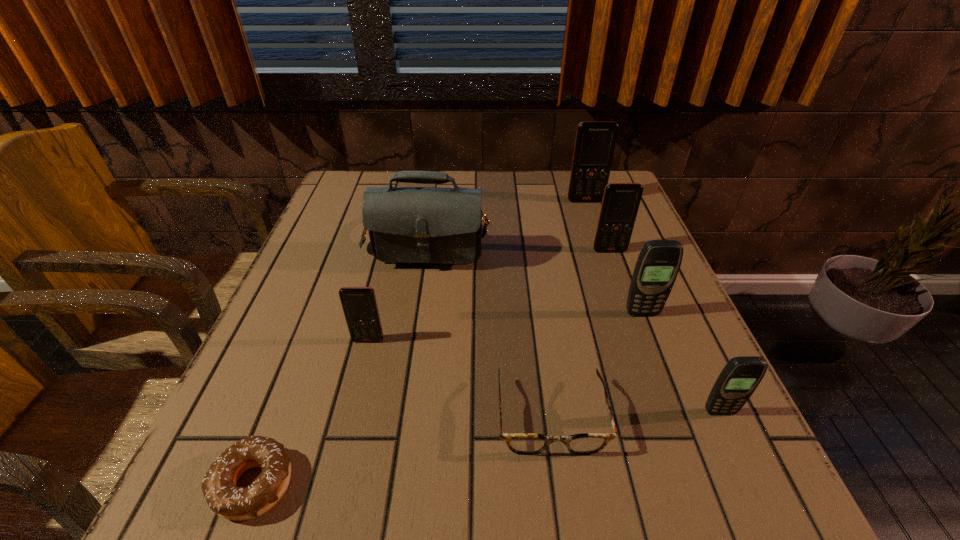
The image size is (960, 540). I want to click on blank region between the spectacles and the leftmost cellular telephone, so click(x=459, y=378).

Identify the location of unoccupied area between the third nearest cellular telephone and the nearer gray cellular telephone. The height and width of the screenshot is (540, 960). pyautogui.click(x=681, y=363).

Identify the location of free space between the smaller gray cellular telephone and the shoulder bag. The image size is (960, 540). (574, 321).

This screenshot has width=960, height=540. What are the coordinates of `vacant area that lies between the fourth farthest object and the tallest cellular telephone` in the screenshot? It's located at (613, 257).

The width and height of the screenshot is (960, 540). I want to click on the seventh closest object to the doughnut, so click(595, 143).

This screenshot has height=540, width=960. Find the location of `the sixth closest object to the spectacles`. the sixth closest object to the spectacles is located at coordinates (620, 204).

Identify which cellular telephone is located as the nearest to the chocolate doughnut. Please provide its 2D coordinates. Your answer should be formatted as a tuple, i.e. [(x, y)], where the tuple contains the x and y coordinates of a point satisfying the conditions above.

[(359, 304)]

You are a GUI agent. You are given a task and a screenshot of the screen. Output one action in this format:
    pyautogui.click(x=<x>, y=<y>)
    Task: Click on the cellular telephone that is the fourth nearest to the nearest orange cellular telephone
    This screenshot has height=540, width=960.
    Given the screenshot: What is the action you would take?
    pyautogui.click(x=595, y=143)

At what (x,y) coordinates should I click in order to perform the action: click on the closest orange cellular telephone to the chocolate doughnut. Please return your answer as a coordinate pair (x, y). The image size is (960, 540). Looking at the image, I should click on (359, 304).

Select which orange cellular telephone appears as the second closest to the doughnut. Please provide its 2D coordinates. Your answer should be formatted as a tuple, i.e. [(x, y)], where the tuple contains the x and y coordinates of a point satisfying the conditions above.

[(620, 204)]